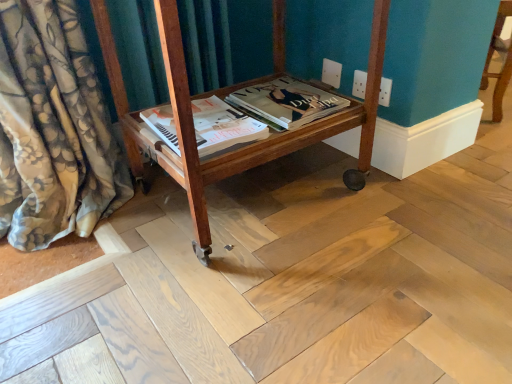
Question: Does point (258, 127) appear closer or farther from the camera than point (270, 105)?

Choices:
 (A) farther
 (B) closer

Answer: (B)

Question: Is matte paper magazine at center, which is the 1th magazine from left to right, to the left or to the right of matte paper magazine at center, the second magazine in the left-to-right sequence, in the image?

Choices:
 (A) right
 (B) left

Answer: (B)

Question: Which object is positioned farthest from the wooden cart at center?

Choices:
 (A) matte paper magazine at center, the second magazine in the left-to-right sequence
 (B) matte paper magazine at center, which is the 1th magazine from left to right

Answer: (A)

Question: Which object is positioned farthest from the matte paper magazine at center, which appears as the 1th magazine when viewed from the right?

Choices:
 (A) matte paper magazine at center, which is the 1th magazine from left to right
 (B) wooden cart at center

Answer: (B)